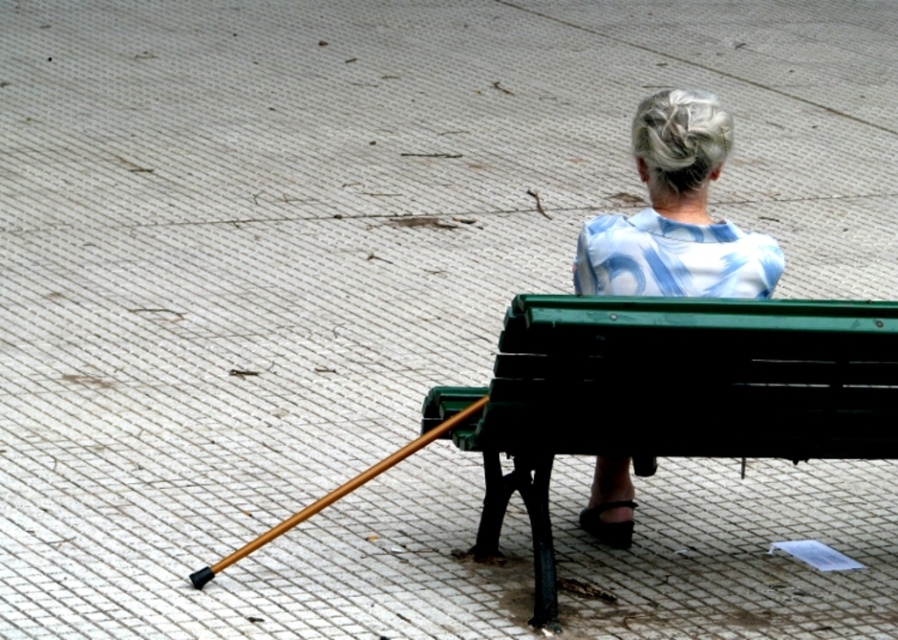
You are standing in front of the bench and want to place two markers on the pavement at the coordinates point (578, 276) and point (377, 464). Which marker will be closer to you?

Point (578, 276) is closer to the viewer than point (377, 464), so the marker at point (578, 276) will be closer to you.

You are a person who needs to use the wooden cane at lower left to stand up from the green painted wood bench at center. Can you reach the cane easily from the bench?

The green painted wood bench at center is much taller than the wooden cane at lower left, so you might have difficulty reaching the cane easily from the bench.